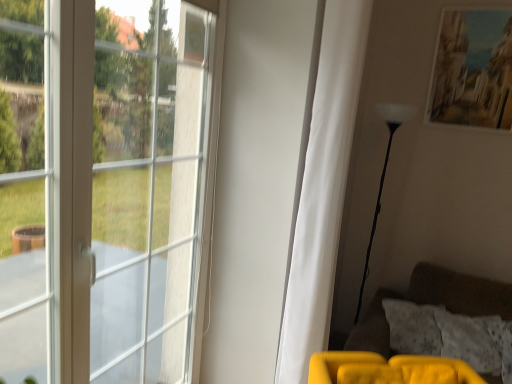
Question: In terms of width, does velvet yellow couch at lower right look wider or thinner when compared to white matte curtain at center?

Choices:
 (A) wide
 (B) thin

Answer: (A)

Question: Considering their positions, is velvet yellow couch at lower right located in front of or behind white matte curtain at center?

Choices:
 (A) front
 (B) behind

Answer: (B)

Question: Based on their relative distances, which object is nearer to the white matte curtain at center?

Choices:
 (A) velvet yellow couch at lower right
 (B) white glass window at left
 (C) white glossy floor lamp at right
 (D) matte paper picture frame at upper right
 (E) fluffy white pillow at lower right

Answer: (B)

Question: Which object is positioned closest to the fluffy white pillow at lower right?

Choices:
 (A) white glass window at left
 (B) matte paper picture frame at upper right
 (C) velvet yellow couch at lower right
 (D) white matte curtain at center
 (E) white glossy floor lamp at right

Answer: (C)